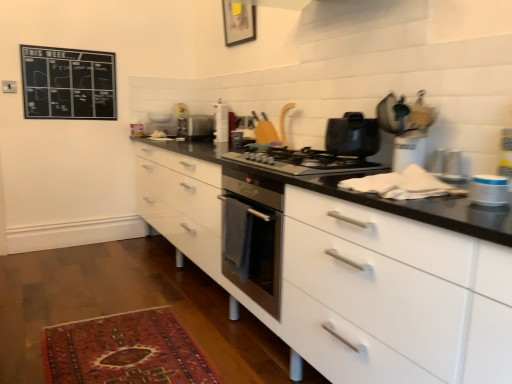
Question: Is wooden picture frame at upper center aimed at satin black gas stove at center?

Choices:
 (A) no
 (B) yes

Answer: (A)

Question: From a real-world perspective, is wooden picture frame at upper center beneath satin black gas stove at center?

Choices:
 (A) no
 (B) yes

Answer: (A)

Question: Is wooden picture frame at upper center facing away from satin black gas stove at center?

Choices:
 (A) yes
 (B) no

Answer: (B)

Question: From the image's perspective, is wooden picture frame at upper center located beneath satin black gas stove at center?

Choices:
 (A) no
 (B) yes

Answer: (A)

Question: Would you say wooden picture frame at upper center is outside satin black gas stove at center?

Choices:
 (A) yes
 (B) no

Answer: (A)

Question: From a real-world perspective, is wooden picture frame at upper center on top of satin black gas stove at center?

Choices:
 (A) no
 (B) yes

Answer: (B)

Question: Is carpeted rug at lower left looking in the opposite direction of satin black gas stove at center?

Choices:
 (A) yes
 (B) no

Answer: (B)

Question: Considering the relative positions of carpeted rug at lower left and satin black gas stove at center in the image provided, is carpeted rug at lower left to the right of satin black gas stove at center from the viewer's perspective?

Choices:
 (A) yes
 (B) no

Answer: (B)

Question: From the image's perspective, does carpeted rug at lower left appear lower than satin black gas stove at center?

Choices:
 (A) no
 (B) yes

Answer: (B)

Question: Is carpeted rug at lower left shorter than satin black gas stove at center?

Choices:
 (A) no
 (B) yes

Answer: (B)

Question: Is carpeted rug at lower left touching satin black gas stove at center?

Choices:
 (A) yes
 (B) no

Answer: (B)

Question: Is carpeted rug at lower left to the left of satin black gas stove at center from the viewer's perspective?

Choices:
 (A) yes
 (B) no

Answer: (A)

Question: From a real-world perspective, is white plastic container at right, acting as the fourth appliance starting from the back, physically above shiny black pot at center?

Choices:
 (A) yes
 (B) no

Answer: (B)